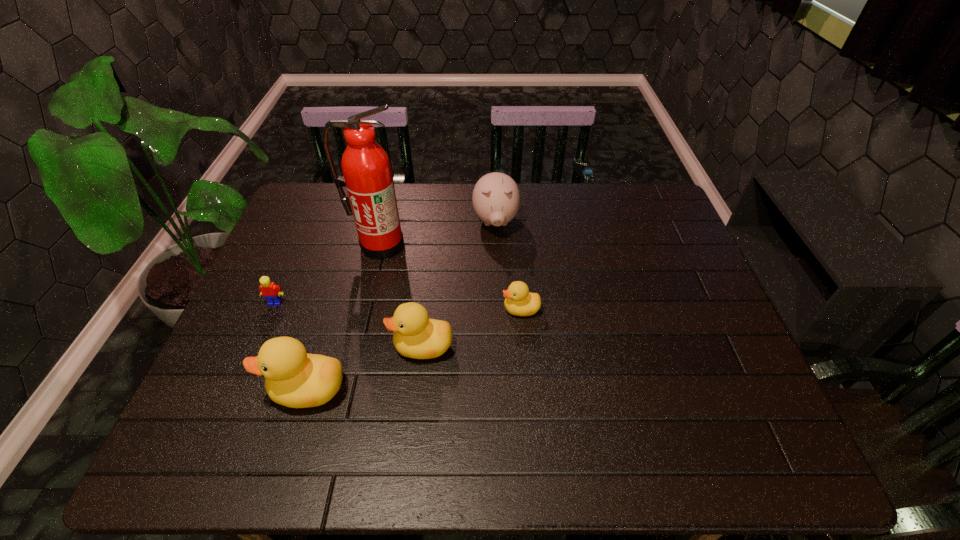
Please point a spot on the right to add another duckling. Please provide its 2D coordinates. Your answer should be formatted as a tuple, i.e. [(x, y)], where the tuple contains the x and y coordinates of a point satisfying the conditions above.

[(607, 276)]